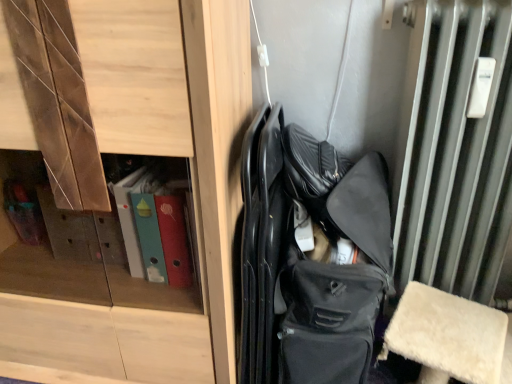
Question: Is matte black bag at center next to wooden cabinet at center?

Choices:
 (A) no
 (B) yes

Answer: (A)

Question: Would you consider matte black bag at center to be distant from wooden cabinet at center?

Choices:
 (A) yes
 (B) no

Answer: (B)

Question: From the image's perspective, does matte black bag at center appear higher than wooden cabinet at center?

Choices:
 (A) no
 (B) yes

Answer: (A)

Question: Does matte black bag at center have a greater height compared to wooden cabinet at center?

Choices:
 (A) yes
 (B) no

Answer: (B)

Question: Is matte black bag at center facing away from wooden cabinet at center?

Choices:
 (A) yes
 (B) no

Answer: (B)

Question: Is matte black bag at center shorter than wooden cabinet at center?

Choices:
 (A) no
 (B) yes

Answer: (B)

Question: Considering the relative sizes of wooden cabinet at center and matte black bag at center in the image provided, is wooden cabinet at center thinner than matte black bag at center?

Choices:
 (A) no
 (B) yes

Answer: (A)

Question: Considering the relative sizes of wooden cabinet at center and matte black bag at center in the image provided, is wooden cabinet at center wider than matte black bag at center?

Choices:
 (A) yes
 (B) no

Answer: (A)

Question: From the image's perspective, is wooden cabinet at center beneath matte black bag at center?

Choices:
 (A) yes
 (B) no

Answer: (B)

Question: Would you say wooden cabinet at center contains matte black bag at center?

Choices:
 (A) yes
 (B) no

Answer: (B)

Question: Considering the relative sizes of wooden cabinet at center and matte black bag at center in the image provided, is wooden cabinet at center smaller than matte black bag at center?

Choices:
 (A) yes
 (B) no

Answer: (B)

Question: Considering the relative sizes of wooden cabinet at center and matte black bag at center in the image provided, is wooden cabinet at center bigger than matte black bag at center?

Choices:
 (A) yes
 (B) no

Answer: (A)

Question: In terms of size, does matte black bag at center appear bigger or smaller than wooden cabinet at center?

Choices:
 (A) small
 (B) big

Answer: (A)